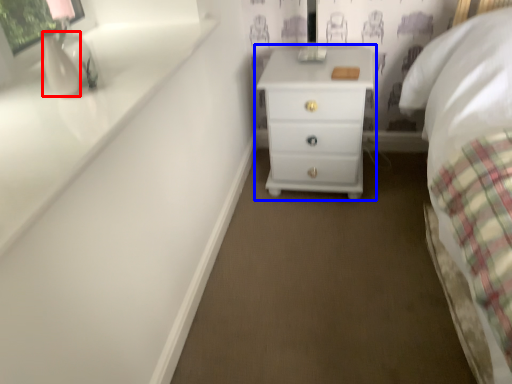
Question: Which object is further to the camera taking this photo, vase (highlighted by a red box) or chest of drawers (highlighted by a blue box)?

Choices:
 (A) vase
 (B) chest of drawers

Answer: (B)